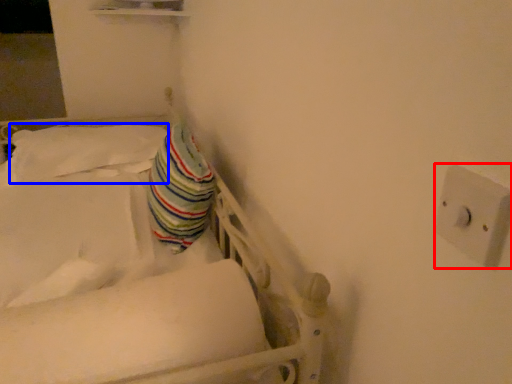
Question: Among these objects, which one is farthest to the camera, electric outlet (highlighted by a red box) or pillow (highlighted by a blue box)?

Choices:
 (A) electric outlet
 (B) pillow

Answer: (B)